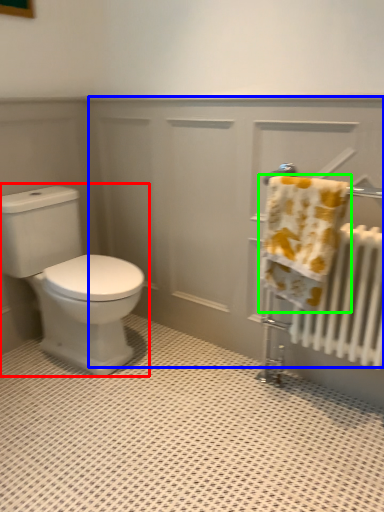
Question: Estimate the real-world distances between objects in this image. Which object is closer to toilet (highlighted by a red box), screen door (highlighted by a blue box) or towel (highlighted by a green box)?

Choices:
 (A) screen door
 (B) towel

Answer: (A)